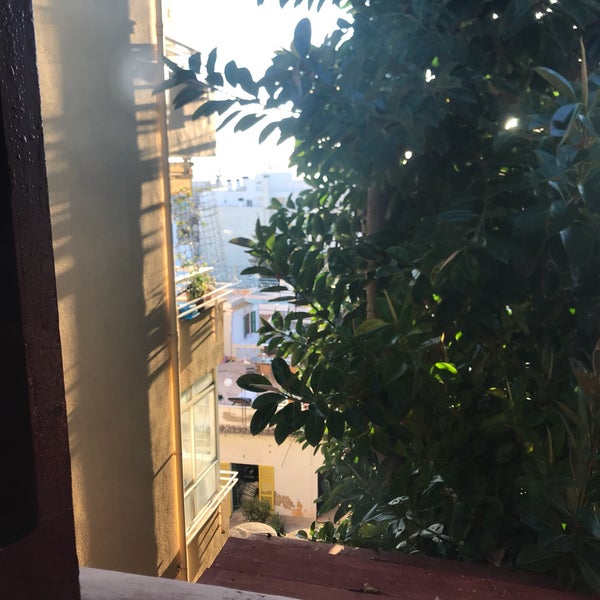
You are a GUI agent. You are given a task and a screenshot of the screen. Output one action in this format:
    pyautogui.click(x=<x>, y=<y>)
    Task: Click on the window sill
    
    Given the screenshot: What is the action you would take?
    pyautogui.click(x=207, y=591)